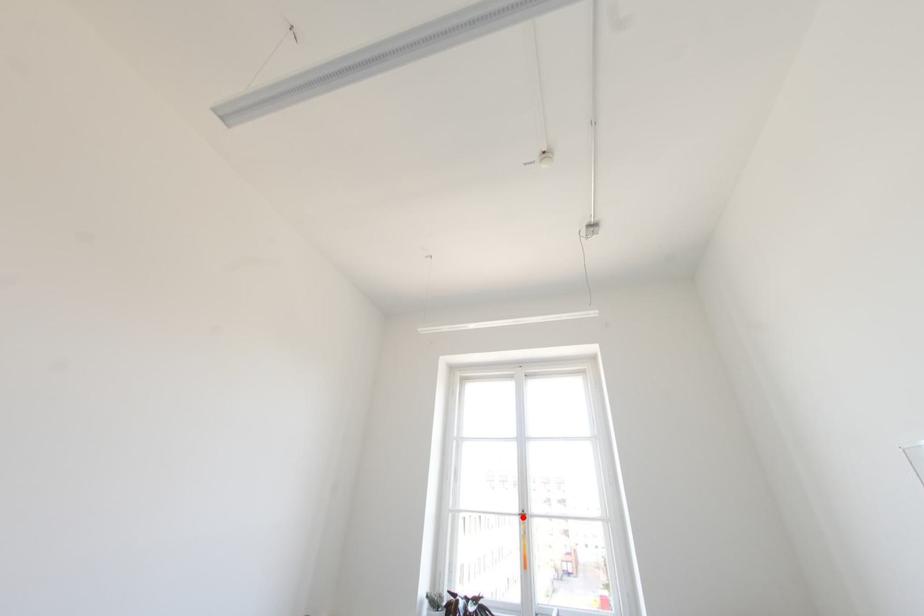
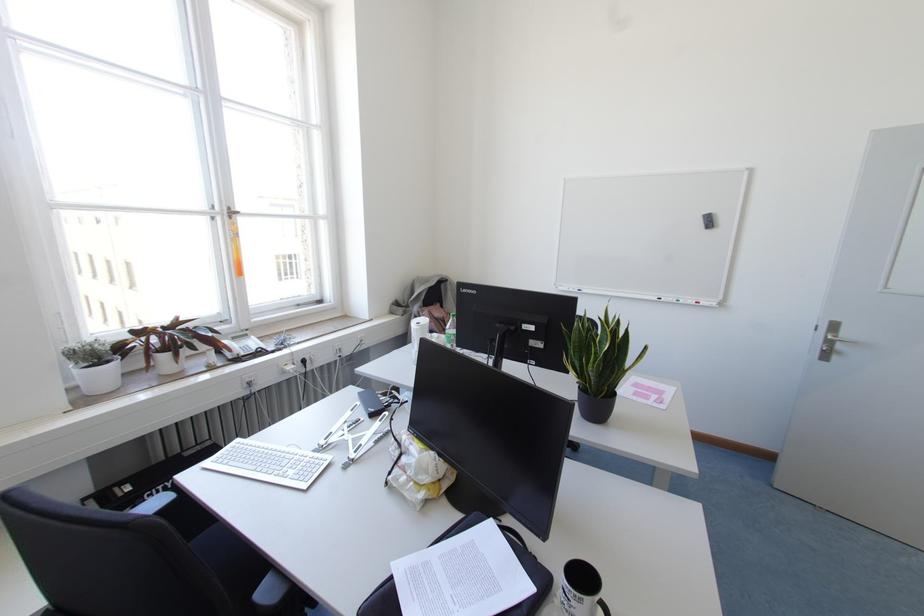
Find the pixel in the second image that matches the highlighted location in the first image.

(229, 217)